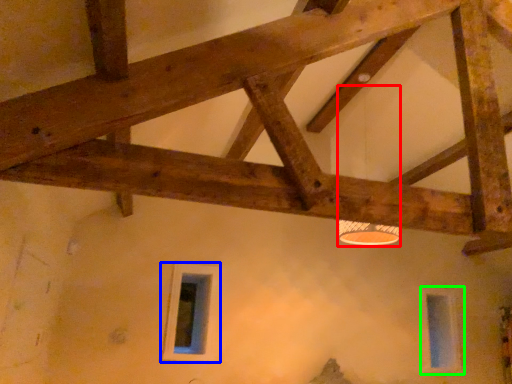
Question: Estimate the real-world distances between objects in this image. Which object is closer to lamp (highlighted by a red box), window (highlighted by a blue box) or window (highlighted by a green box)?

Choices:
 (A) window
 (B) window

Answer: (A)